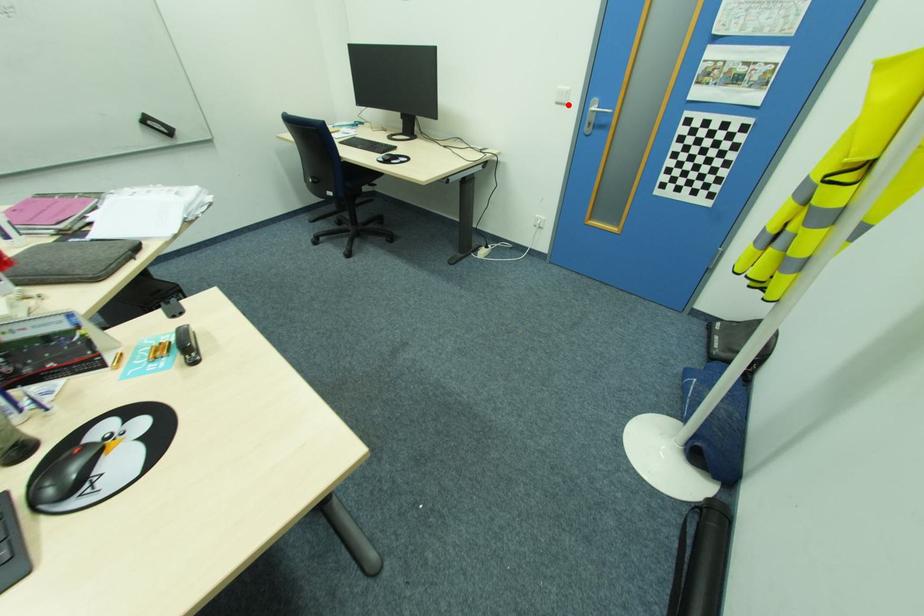
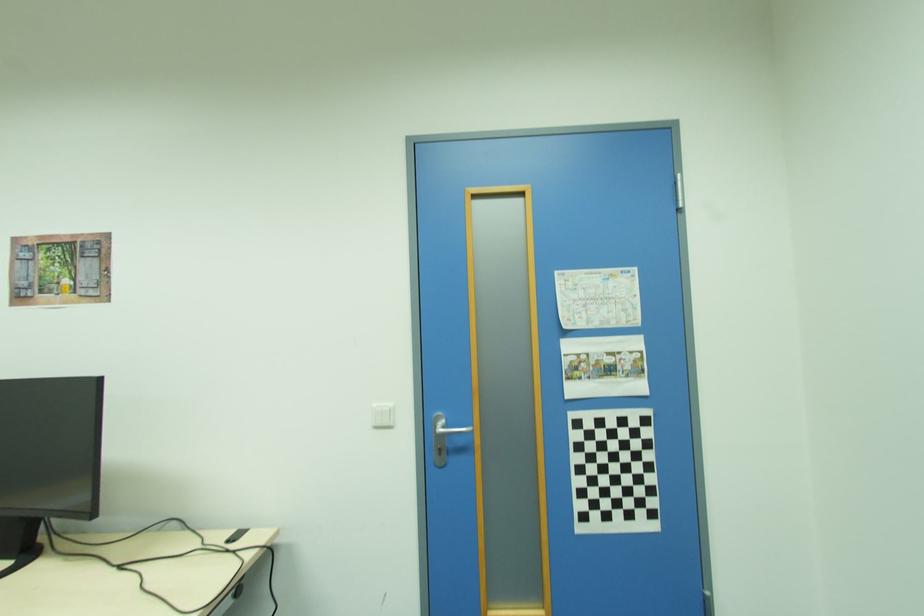
Locate, in the second image, the point that corresponds to the highlighted location in the first image.

(394, 427)